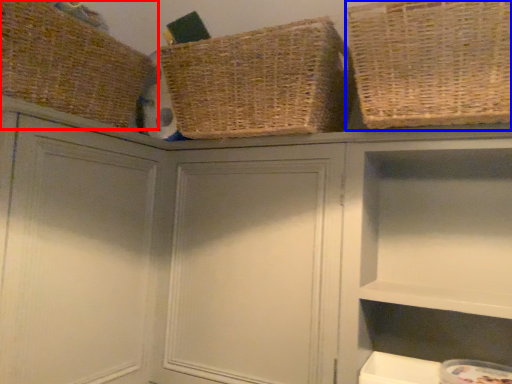
Question: Which object appears farthest to the camera in this image, basket (highlighted by a red box) or basket (highlighted by a blue box)?

Choices:
 (A) basket
 (B) basket

Answer: (A)